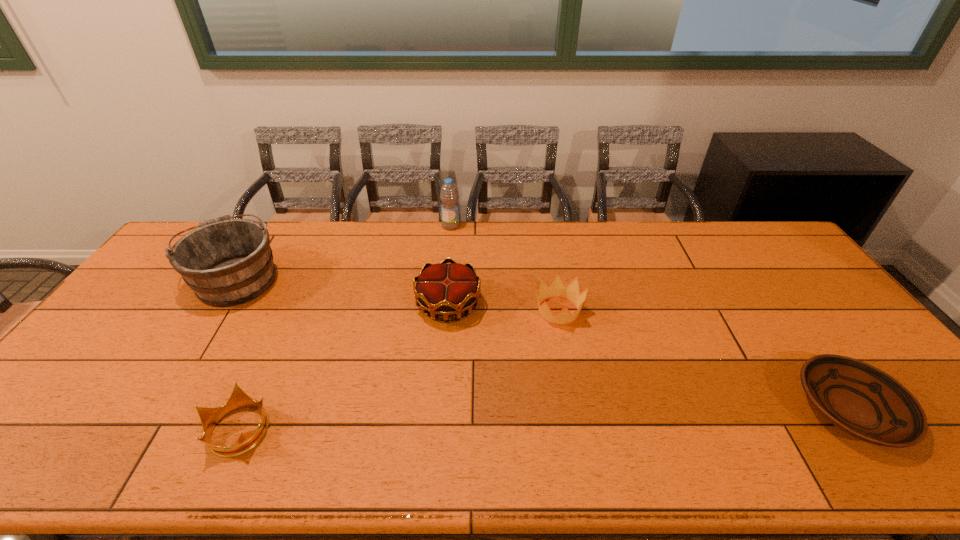
This screenshot has height=540, width=960. Identify the location of vacant space located 0.280m on the right of the second crown from left to right. (575, 305).

What are the coordinates of `free location located on the right of the rightmost crown` in the screenshot? It's located at (702, 311).

You are a GUI agent. You are given a task and a screenshot of the screen. Output one action in this format:
    pyautogui.click(x=<x>, y=<y>)
    Task: Click on the vacant space located on the back of the fifth object from right to left
    The image size is (960, 540).
    Given the screenshot: What is the action you would take?
    pyautogui.click(x=288, y=318)

Locate an element on the screen. This screenshot has width=960, height=540. vacant area located on the left of the plate is located at coordinates (668, 409).

Where is `water bottle that is at the far edge`? water bottle that is at the far edge is located at coordinates pyautogui.click(x=449, y=195).

Find the location of `wine bucket situated at the far edge`. wine bucket situated at the far edge is located at coordinates (226, 262).

Locate an element on the screen. The image size is (960, 540). crown that is positioned at the near edge is located at coordinates (209, 417).

What are the coordinates of `plate located in the near edge section of the desktop` in the screenshot? It's located at (860, 399).

In order to click on object that is at the left edge in this screenshot , I will do `click(226, 262)`.

Locate an element on the screen. object at the right edge is located at coordinates (860, 399).